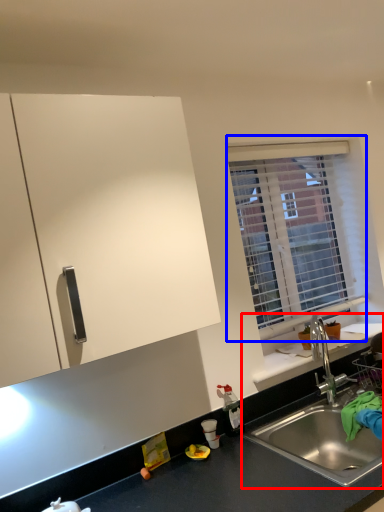
Question: Which of the following is the closest to the observer, sink (highlighted by a red box) or window (highlighted by a blue box)?

Choices:
 (A) sink
 (B) window

Answer: (A)